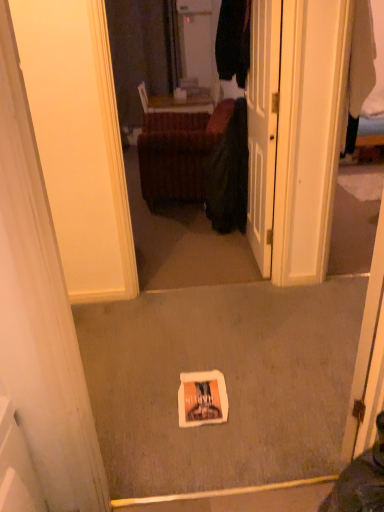
Question: Is dark green fabric at center next to velvet brown ottoman at center and touching it?

Choices:
 (A) no
 (B) yes

Answer: (A)

Question: Is dark green fabric at center positioned beyond the bounds of velvet brown ottoman at center?

Choices:
 (A) no
 (B) yes

Answer: (B)

Question: Does dark green fabric at center come in front of velvet brown ottoman at center?

Choices:
 (A) yes
 (B) no

Answer: (A)

Question: Does dark green fabric at center have a greater width compared to velvet brown ottoman at center?

Choices:
 (A) yes
 (B) no

Answer: (B)

Question: Is dark green fabric at center oriented away from velvet brown ottoman at center?

Choices:
 (A) no
 (B) yes

Answer: (B)

Question: Is dark green fabric at center smaller than velvet brown ottoman at center?

Choices:
 (A) yes
 (B) no

Answer: (A)

Question: Is white glossy door at center in contact with velvet brown ottoman at center?

Choices:
 (A) no
 (B) yes

Answer: (A)

Question: Is velvet brown ottoman at center located within white glossy door at center?

Choices:
 (A) yes
 (B) no

Answer: (B)

Question: From the image's perspective, does white glossy door at center appear higher than velvet brown ottoman at center?

Choices:
 (A) no
 (B) yes

Answer: (A)

Question: Is white glossy door at center not close to velvet brown ottoman at center?

Choices:
 (A) no
 (B) yes

Answer: (B)

Question: Could you tell me if white glossy door at center is facing velvet brown ottoman at center?

Choices:
 (A) no
 (B) yes

Answer: (A)

Question: Is white glossy door at center positioned before velvet brown ottoman at center?

Choices:
 (A) no
 (B) yes

Answer: (B)

Question: Is velvet brown ottoman at center at the left side of dark green fabric at center?

Choices:
 (A) yes
 (B) no

Answer: (A)